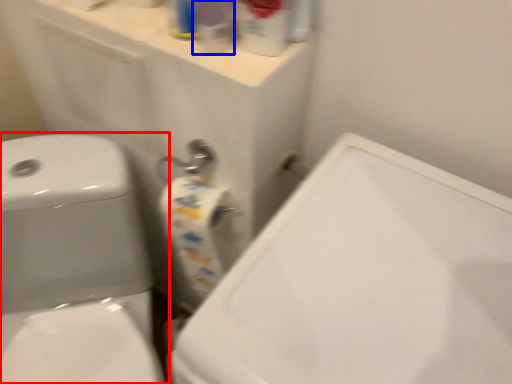
Question: Among these objects, which one is nearest to the camera, toilet (highlighted by a red box) or cleaning product (highlighted by a blue box)?

Choices:
 (A) toilet
 (B) cleaning product

Answer: (B)